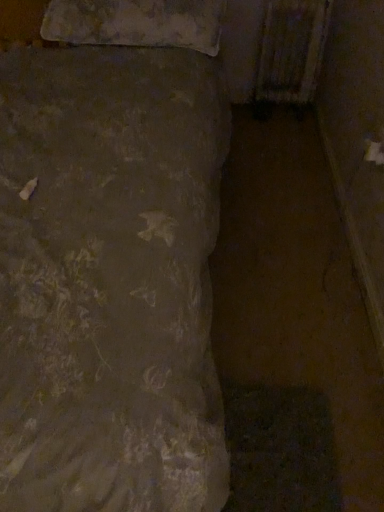
Question: Does rusty metal radiator at upper right have a lesser width compared to textured beige pillow at upper left?

Choices:
 (A) no
 (B) yes

Answer: (B)

Question: Are rusty metal radiator at upper right and textured beige pillow at upper left making contact?

Choices:
 (A) no
 (B) yes

Answer: (A)

Question: Does rusty metal radiator at upper right appear on the right side of textured beige pillow at upper left?

Choices:
 (A) yes
 (B) no

Answer: (A)

Question: Considering the relative sizes of rusty metal radiator at upper right and textured beige pillow at upper left in the image provided, is rusty metal radiator at upper right wider than textured beige pillow at upper left?

Choices:
 (A) no
 (B) yes

Answer: (A)

Question: Considering the relative sizes of rusty metal radiator at upper right and textured beige pillow at upper left in the image provided, is rusty metal radiator at upper right bigger than textured beige pillow at upper left?

Choices:
 (A) no
 (B) yes

Answer: (A)

Question: Is rusty metal radiator at upper right positioned beyond the bounds of textured beige pillow at upper left?

Choices:
 (A) no
 (B) yes

Answer: (B)

Question: Can you confirm if textured beige pillow at upper left is positioned to the right of rusty metal radiator at upper right?

Choices:
 (A) no
 (B) yes

Answer: (A)

Question: Is textured beige pillow at upper left further to the viewer compared to rusty metal radiator at upper right?

Choices:
 (A) yes
 (B) no

Answer: (B)

Question: Is textured beige pillow at upper left to the left of rusty metal radiator at upper right from the viewer's perspective?

Choices:
 (A) yes
 (B) no

Answer: (A)

Question: From a real-world perspective, is textured beige pillow at upper left beneath rusty metal radiator at upper right?

Choices:
 (A) no
 (B) yes

Answer: (A)

Question: Is textured beige pillow at upper left in front of rusty metal radiator at upper right?

Choices:
 (A) yes
 (B) no

Answer: (A)

Question: Does textured beige pillow at upper left have a lesser width compared to rusty metal radiator at upper right?

Choices:
 (A) no
 (B) yes

Answer: (A)

Question: Is point click(x=307, y=53) positioned closer to the camera than point click(x=66, y=6)?

Choices:
 (A) closer
 (B) farther

Answer: (B)